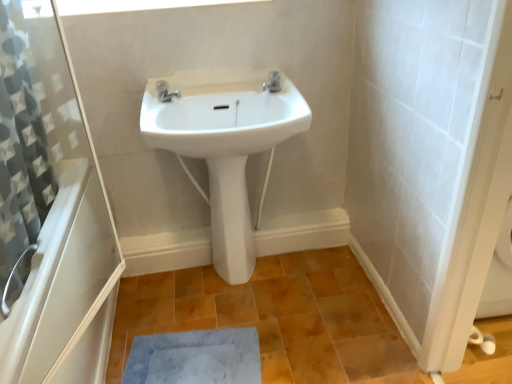
You are a GUI agent. You are given a task and a screenshot of the screen. Output one action in this format:
    pyautogui.click(x=<x>, y=<y>)
    Task: Click on the free point below white glossy bidet at center (from a real-world perspective)
    
    Given the screenshot: What is the action you would take?
    pyautogui.click(x=240, y=282)